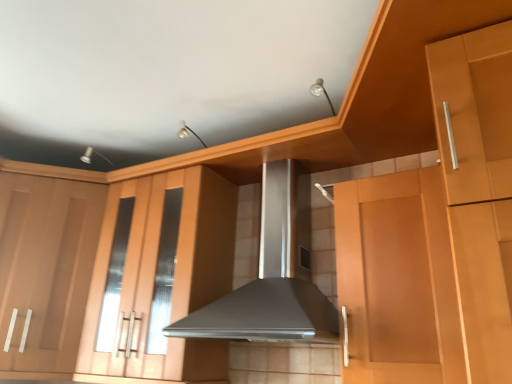
Question: Can you confirm if matte wood cabinet at center, the second cabinetry positioned from the left, is smaller than matte wood cabinet at left, positioned as the 1th cabinetry in left-to-right order?

Choices:
 (A) yes
 (B) no

Answer: (A)

Question: Considering the relative sizes of matte wood cabinet at center, the second cabinetry positioned from the left, and matte wood cabinet at left, arranged as the second cabinetry when viewed from the right, in the image provided, is matte wood cabinet at center, the second cabinetry positioned from the left, taller than matte wood cabinet at left, arranged as the second cabinetry when viewed from the right,?

Choices:
 (A) yes
 (B) no

Answer: (A)

Question: From the image's perspective, would you say matte wood cabinet at center, the second cabinetry positioned from the left, is shown under matte wood cabinet at left, arranged as the second cabinetry when viewed from the right?

Choices:
 (A) yes
 (B) no

Answer: (B)

Question: Does matte wood cabinet at center, which is the first cabinetry in right-to-left order, have a lesser width compared to matte wood cabinet at left, arranged as the second cabinetry when viewed from the right?

Choices:
 (A) no
 (B) yes

Answer: (B)

Question: Is matte wood cabinet at center, the second cabinetry positioned from the left, turned away from matte wood cabinet at left, positioned as the 1th cabinetry in left-to-right order?

Choices:
 (A) no
 (B) yes

Answer: (A)

Question: Does matte wood cabinet at center, the second cabinetry positioned from the left, lie behind matte wood cabinet at left, positioned as the 1th cabinetry in left-to-right order?

Choices:
 (A) no
 (B) yes

Answer: (A)

Question: Can you confirm if matte wood cabinet at left, arranged as the second cabinetry when viewed from the right, is shorter than satin silver range hood at center?

Choices:
 (A) yes
 (B) no

Answer: (B)

Question: Is matte wood cabinet at left, arranged as the second cabinetry when viewed from the right, not inside satin silver range hood at center?

Choices:
 (A) no
 (B) yes

Answer: (B)

Question: Is matte wood cabinet at left, arranged as the second cabinetry when viewed from the right, to the left of satin silver range hood at center from the viewer's perspective?

Choices:
 (A) yes
 (B) no

Answer: (A)

Question: From a real-world perspective, is matte wood cabinet at left, positioned as the 1th cabinetry in left-to-right order, physically below satin silver range hood at center?

Choices:
 (A) no
 (B) yes

Answer: (B)

Question: From the image's perspective, is matte wood cabinet at left, positioned as the 1th cabinetry in left-to-right order, beneath satin silver range hood at center?

Choices:
 (A) yes
 (B) no

Answer: (A)

Question: Considering the relative positions of matte wood cabinet at left, positioned as the 1th cabinetry in left-to-right order, and satin silver range hood at center in the image provided, is matte wood cabinet at left, positioned as the 1th cabinetry in left-to-right order, to the right of satin silver range hood at center from the viewer's perspective?

Choices:
 (A) yes
 (B) no

Answer: (B)

Question: From the image's perspective, is matte wood cabinet at left, positioned as the 1th cabinetry in left-to-right order, located beneath matte wood cabinet at center, which is the first cabinetry in right-to-left order?

Choices:
 (A) no
 (B) yes

Answer: (B)